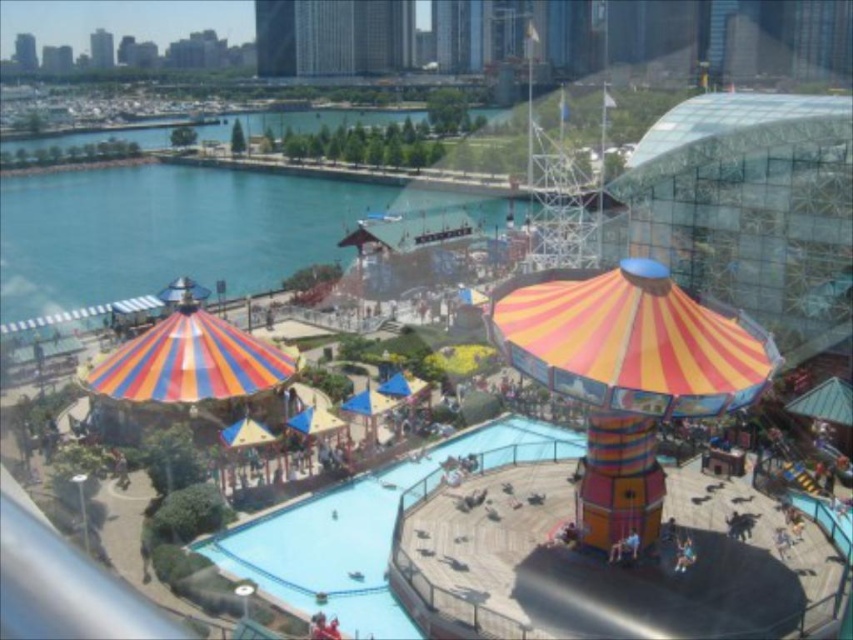
Which is in front, point (323, 548) or point (467, 189)?

Point (323, 548)

Is blue wooden pool at center below blue water at center?

Indeed, blue wooden pool at center is positioned under blue water at center.

Find the location of a particular element. Image resolution: width=853 pixels, height=640 pixels. blue wooden pool at center is located at coordinates (363, 531).